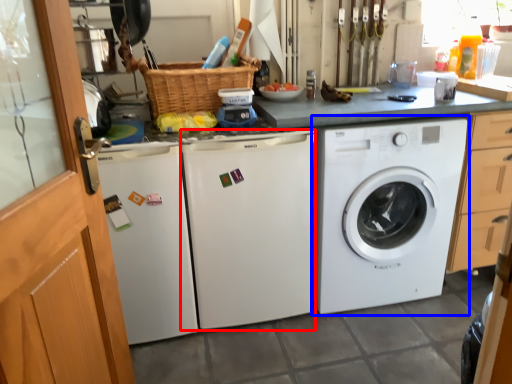
Question: Which object is further to the camera taking this photo, washing machine (highlighted by a red box) or washing machine (highlighted by a blue box)?

Choices:
 (A) washing machine
 (B) washing machine

Answer: (B)